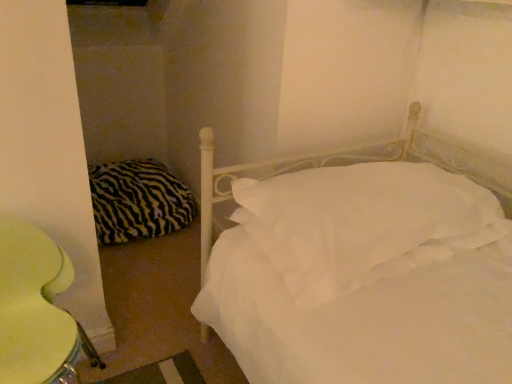
Question: Do you think yellow fabric swivel chair at lower left is within white soft pillow at center, which is counted as the 2th pillow, starting from the left, or outside of it?

Choices:
 (A) inside
 (B) outside

Answer: (B)

Question: From the image's perspective, is yellow fabric swivel chair at lower left located above or below white soft pillow at center, which is counted as the 2th pillow, starting from the back?

Choices:
 (A) above
 (B) below

Answer: (B)

Question: Which object is positioned closest to the white soft pillow at center, positioned as the 1th pillow in right-to-left order?

Choices:
 (A) yellow fabric swivel chair at lower left
 (B) zebra-patterned fabric pillow at left, the 1th pillow positioned from the left

Answer: (A)

Question: Based on their relative distances, which object is nearer to the zebra-patterned fabric pillow at left, placed as the second pillow when sorted from right to left?

Choices:
 (A) white soft pillow at center, which is counted as the 1th pillow, starting from the front
 (B) yellow fabric swivel chair at lower left

Answer: (B)